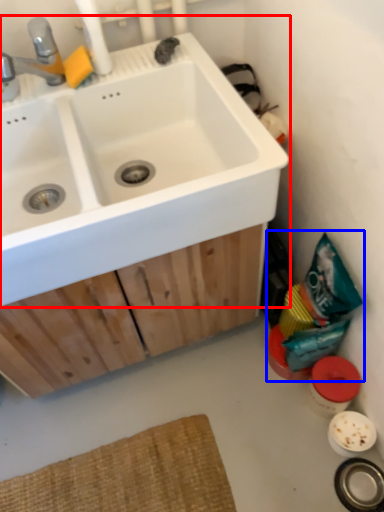
Question: Which object appears closest to the camera in this image, sink (highlighted by a red box) or garbage (highlighted by a blue box)?

Choices:
 (A) sink
 (B) garbage

Answer: (A)